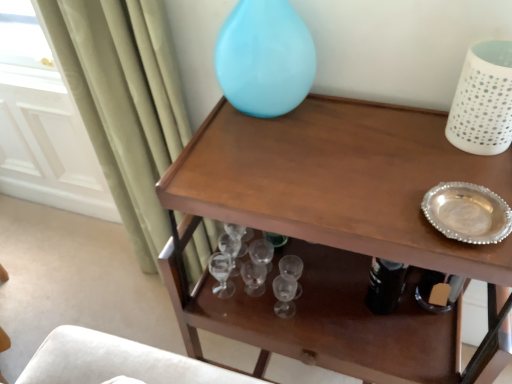
Question: Considering the positions of white perforated vase at upper right, the second vase positioned from the left, and wooden table at upper center in the image, is white perforated vase at upper right, the second vase positioned from the left, wider or thinner than wooden table at upper center?

Choices:
 (A) wide
 (B) thin

Answer: (B)

Question: Is white perforated vase at upper right, the second vase positioned from the left, taller or shorter than wooden table at upper center?

Choices:
 (A) short
 (B) tall

Answer: (A)

Question: Considering the real-world distances, which object is closest to the wooden table at upper center?

Choices:
 (A) glossy glass vase at upper center, marked as the 2th vase in a right-to-left arrangement
 (B) white perforated vase at upper right, the second vase positioned from the left

Answer: (A)

Question: Which of these objects is positioned closest to the glossy glass vase at upper center, the first vase in the left-to-right sequence?

Choices:
 (A) wooden table at upper center
 (B) white perforated vase at upper right, which is counted as the 1th vase, starting from the right

Answer: (A)